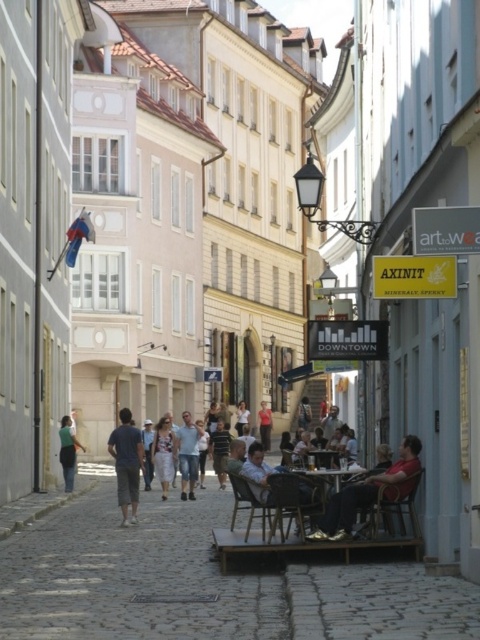
Can you confirm if dark green fabric pants at center is shorter than wooden table at center?

No.

Is point (64, 420) farther from camera compared to point (335, 476)?

Yes, point (64, 420) is behind point (335, 476).

Locate an element on the screen. dark green fabric pants at center is located at coordinates (68, 451).

Which is more to the right, cobblestone alley at center or dark green fabric pants at center?

cobblestone alley at center

Between cobblestone alley at center and dark green fabric pants at center, which one has less height?

cobblestone alley at center

Find the location of a particular element. The width and height of the screenshot is (480, 640). cobblestone alley at center is located at coordinates (205, 582).

Find the location of a particular element. This screenshot has height=640, width=480. matte red shirt at right is located at coordinates (369, 492).

Which is in front, point (418, 451) or point (268, 420)?

Point (418, 451)

Who is more distant from viewer, (327, 508) or (266, 442)?

Point (266, 442)

Where is `matte red shirt at right`? The height and width of the screenshot is (640, 480). matte red shirt at right is located at coordinates (369, 492).